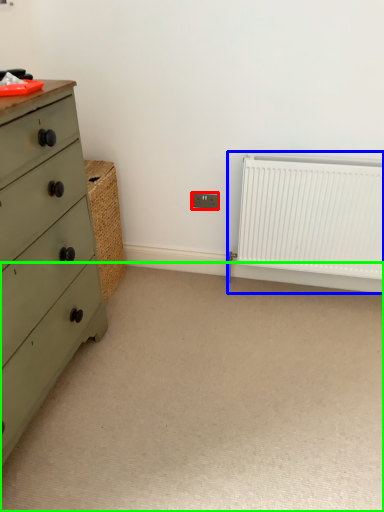
Question: Based on their relative distances, which object is farther from electric outlet (highlighted by a red box)? Choose from radiator (highlighted by a blue box) and plain (highlighted by a green box).

Choices:
 (A) radiator
 (B) plain

Answer: (B)